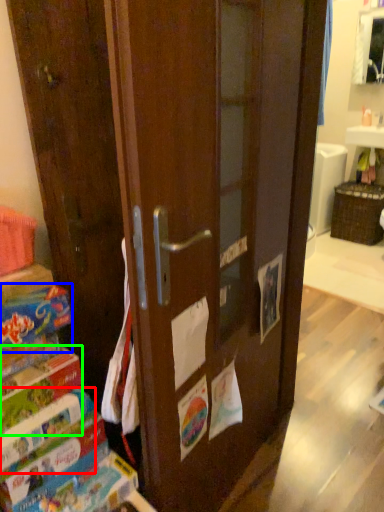
Question: Which is farther away from paperback book (highlighted by a red box)? paperback book (highlighted by a blue box) or paperback book (highlighted by a green box)?

Choices:
 (A) paperback book
 (B) paperback book

Answer: (A)